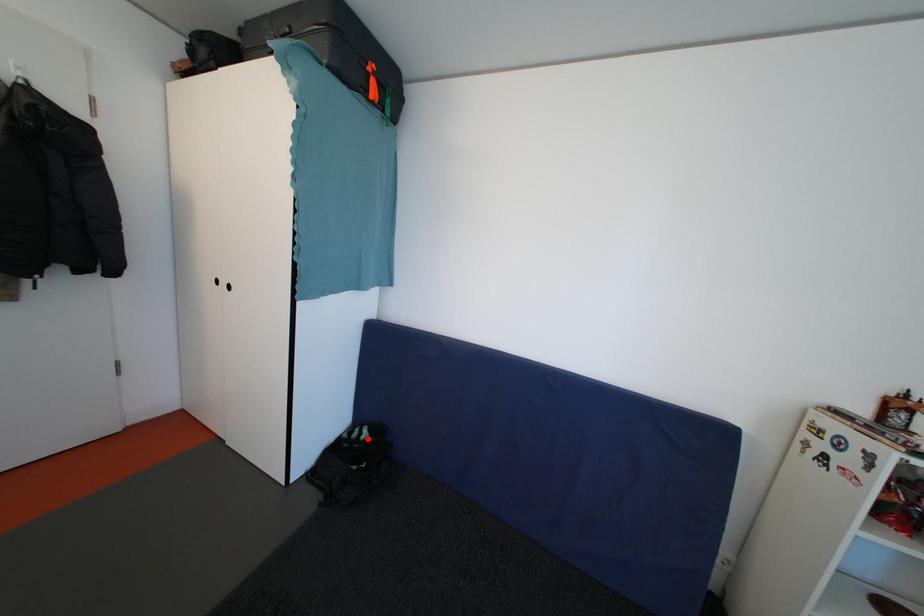
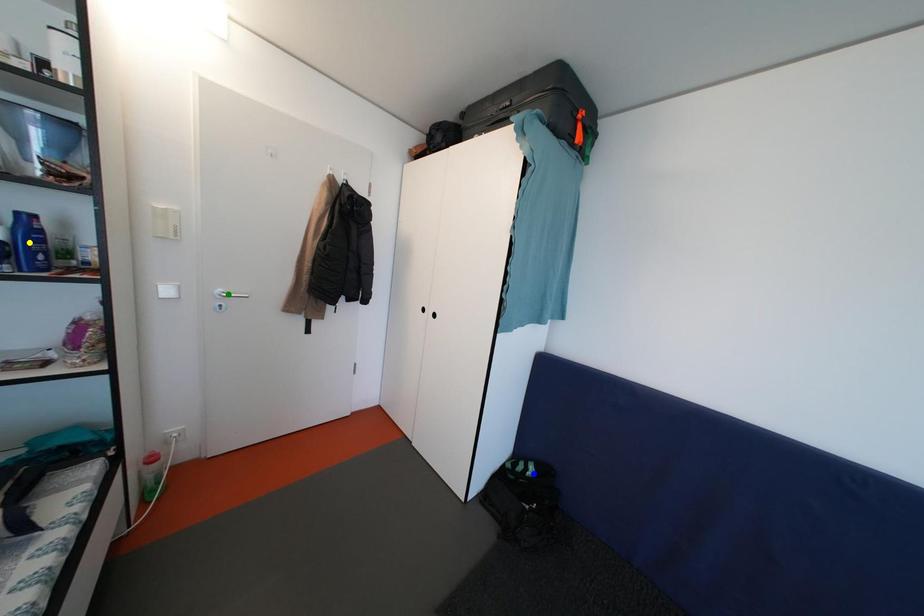
Question: I am providing you with two images of the same scene from different viewpoints. A red point is marked on the first image. You are given multiple points on the second image. Can you choose the point in image 2 that corresponds to the point in image 1?

Choices:
 (A) green point
 (B) yellow point
 (C) blue point

Answer: (C)